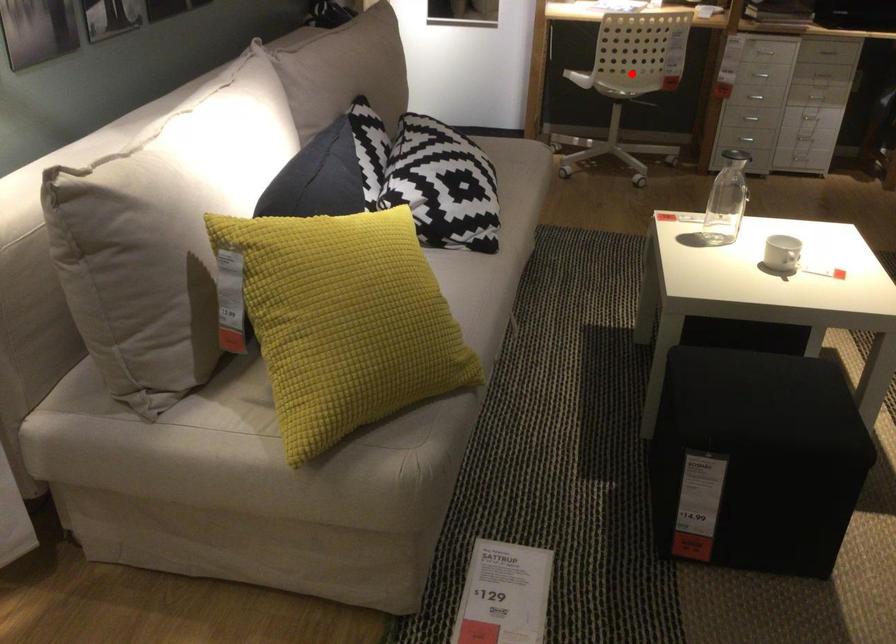
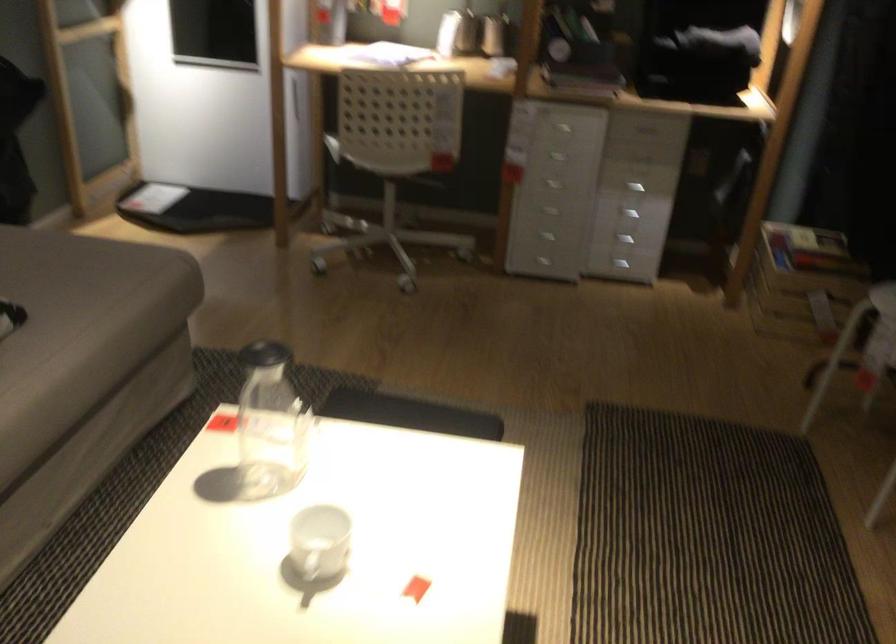
Question: I am providing you with two images of the same scene from different viewpoints. A red point is shown in image1. For the corresponding object point in image2, is it positioned nearer or farther from the camera?

Choices:
 (A) Nearer
 (B) Farther

Answer: (A)